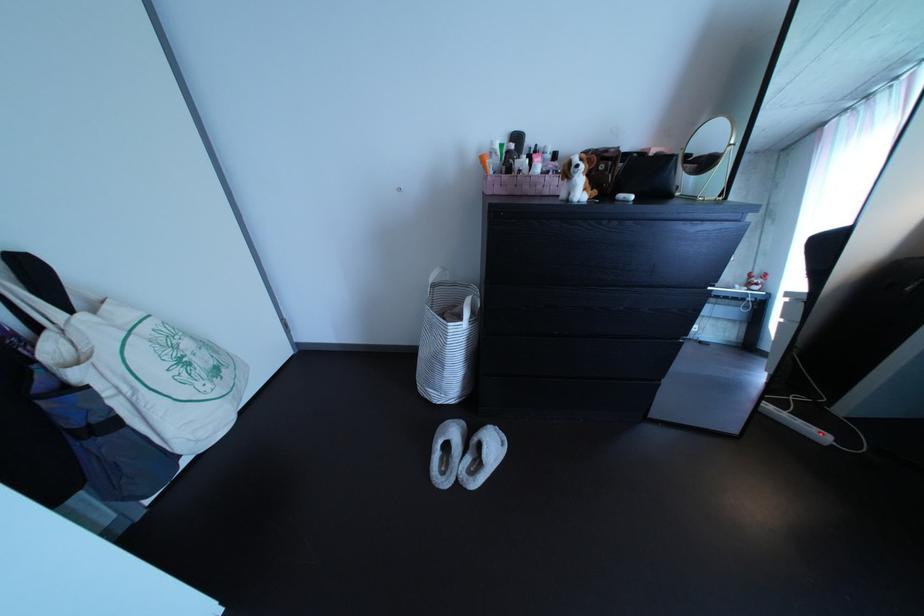
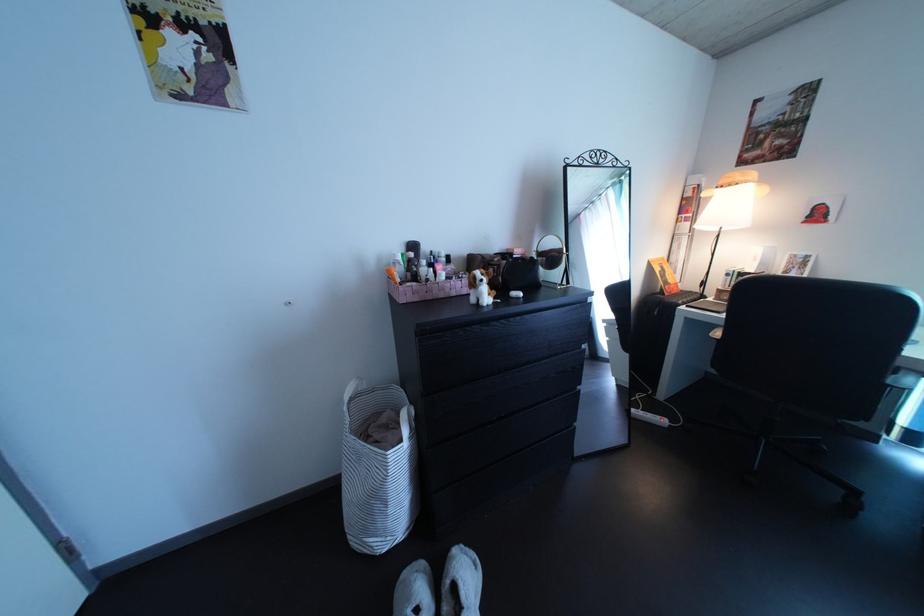
The point at (493, 454) is marked in the first image. Where is the corresponding point in the second image?

(468, 596)